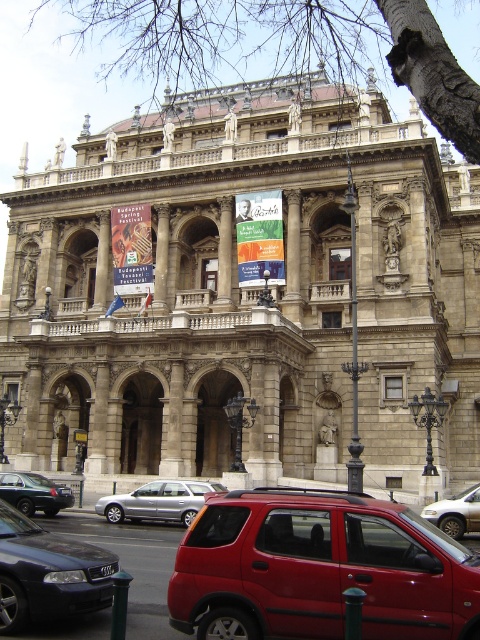
Question: Does black glossy sedan at lower left have a larger size compared to polished bronze streetlight at center?

Choices:
 (A) no
 (B) yes

Answer: (A)

Question: Estimate the real-world distances between objects in this image. Which object is closer to the black glossy sedan at lower left?

Choices:
 (A) silver metallic sedan at center
 (B) polished bronze streetlight at center
 (C) black matte sedan at lower left
 (D) metallic red suv at center

Answer: (D)

Question: Which point is farther to the camera?

Choices:
 (A) (375, 563)
 (B) (351, 342)
 (C) (96, 573)
 (D) (429, 518)

Answer: (B)

Question: Is black glossy sedan at lower left positioned before polished bronze streetlight at center?

Choices:
 (A) yes
 (B) no

Answer: (A)

Question: Does metallic red suv at center come behind silver metallic car at center?

Choices:
 (A) yes
 (B) no

Answer: (B)

Question: Which point appears closest to the camera in this image?

Choices:
 (A) (13, 504)
 (B) (216, 490)

Answer: (A)